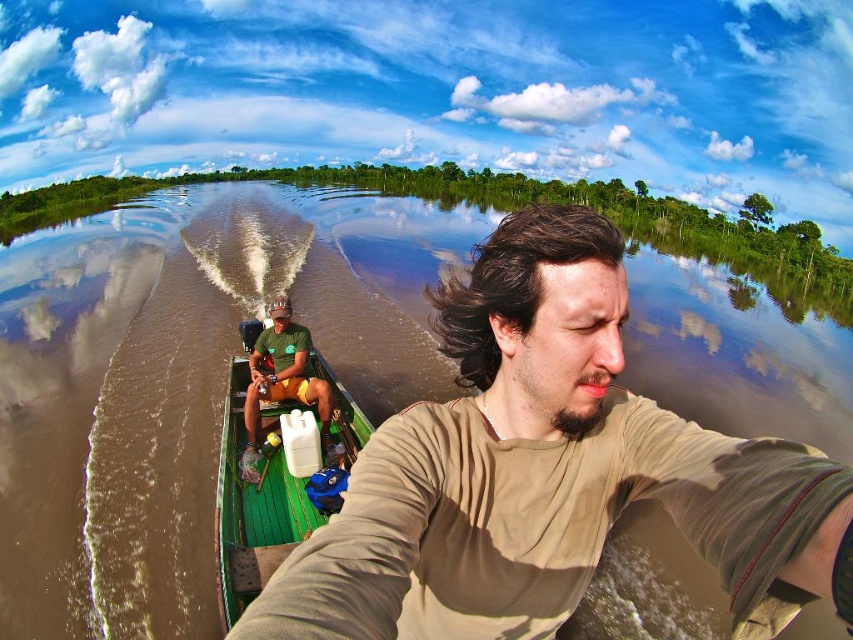
Is point (256, 508) positioned after point (299, 369)?

No.

Identify the location of green wooden boat at center. (256, 502).

Describe the element at coordinates (256, 502) in the screenshot. This screenshot has height=640, width=853. I see `green wooden boat at center` at that location.

At what (x,y) coordinates should I click in order to perform the action: click on green wooden boat at center. Please return your answer as a coordinate pair (x, y). The height and width of the screenshot is (640, 853). Looking at the image, I should click on (256, 502).

Who is positioned more to the right, brown matte shirt at center or green wooden boat at center?

From the viewer's perspective, brown matte shirt at center appears more on the right side.

Does brown matte shirt at center have a greater height compared to green wooden boat at center?

No, brown matte shirt at center is not taller than green wooden boat at center.

This screenshot has width=853, height=640. What do you see at coordinates (549, 472) in the screenshot?
I see `brown matte shirt at center` at bounding box center [549, 472].

Where is `brown matte shirt at center`? The width and height of the screenshot is (853, 640). brown matte shirt at center is located at coordinates (549, 472).

Is point (492, 577) positioned behind point (318, 387)?

No, (492, 577) is in front of (318, 387).

Is brown matte shirt at center to the left of green matte shirt at center from the viewer's perspective?

No, brown matte shirt at center is not to the left of green matte shirt at center.

Which is in front, point (531, 275) or point (302, 342)?

Point (531, 275) is in front.

What are the coordinates of `brown matte shirt at center` in the screenshot? It's located at (549, 472).